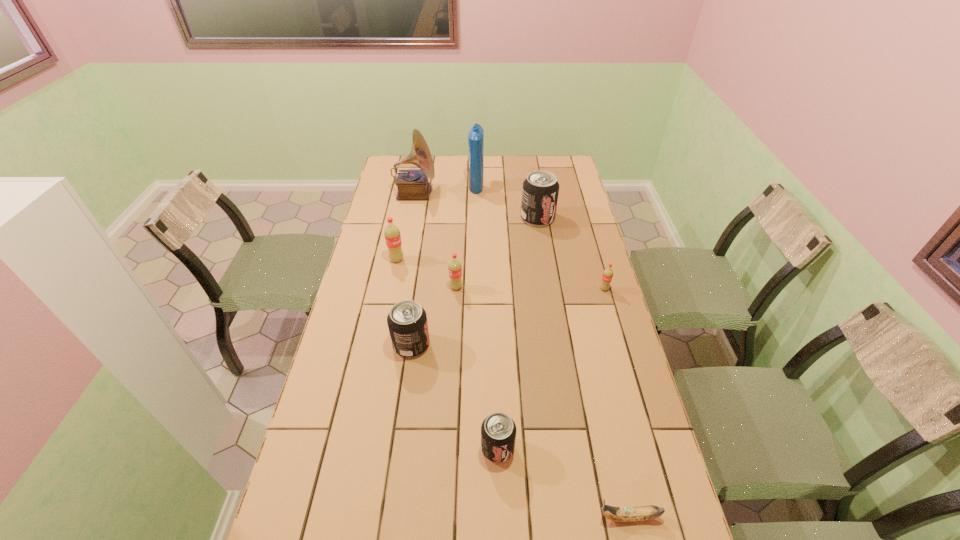
Identify which black soda can is the second nearest to the brown phonograph record. Please provide its 2D coordinates. Your answer should be formatted as a tuple, i.e. [(x, y)], where the tuple contains the x and y coordinates of a point satisfying the conditions above.

[(407, 321)]

Select which black soda can appears as the second closest to the shampoo. Please provide its 2D coordinates. Your answer should be formatted as a tuple, i.e. [(x, y)], where the tuple contains the x and y coordinates of a point satisfying the conditions above.

[(407, 321)]

Identify which red soda is the nearest to the third soda can from left to right. Please provide its 2D coordinates. Your answer should be formatted as a tuple, i.e. [(x, y)], where the tuple contains the x and y coordinates of a point satisfying the conditions above.

[(392, 235)]

This screenshot has width=960, height=540. What are the coordinates of `red soda that is the second closest to the shampoo` in the screenshot? It's located at (455, 268).

Locate an element on the screen. Image resolution: width=960 pixels, height=540 pixels. vacant space that satisfies the following two spatial constraints: 1. on the horn of the phonograph record; 2. on the right side of the rightmost object is located at coordinates (396, 289).

Where is `vacant region that satisfies the following two spatial constraints: 1. on the back side of the fourth soda can from left to right; 2. on the left side of the rightmost object`? vacant region that satisfies the following two spatial constraints: 1. on the back side of the fourth soda can from left to right; 2. on the left side of the rightmost object is located at coordinates (493, 289).

Locate an element on the screen. The height and width of the screenshot is (540, 960). free region that satisfies the following two spatial constraints: 1. on the horn of the brown phonograph record; 2. on the front side of the fourth farthest object is located at coordinates (402, 260).